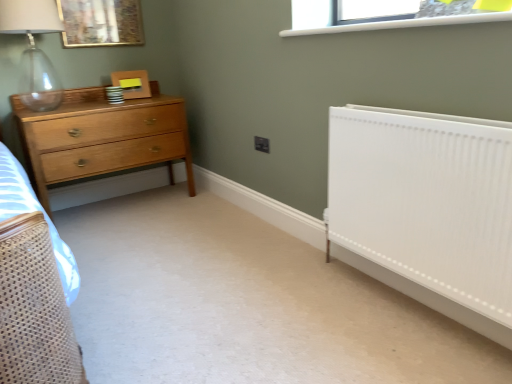
The height and width of the screenshot is (384, 512). What are the coordinates of `vacant area that is situated to the right of light brown wood chest of drawers at left` in the screenshot? It's located at (199, 212).